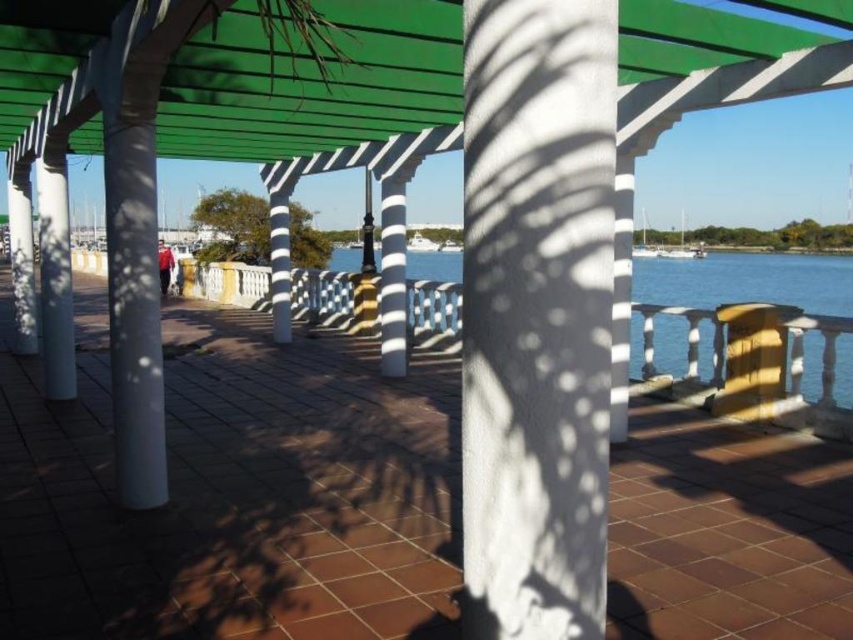
Question: Which of the following is the closest to the observer?

Choices:
 (A) green plastic canopy at upper center
 (B) white textured pillar at center

Answer: (B)

Question: Which of the following is the closest to the observer?

Choices:
 (A) white textured pillar at center
 (B) green plastic canopy at upper center

Answer: (A)

Question: Does white textured pillar at center lie behind green plastic canopy at upper center?

Choices:
 (A) yes
 (B) no

Answer: (B)

Question: Among these points, which one is farthest from the camera?

Choices:
 (A) (548, 348)
 (B) (340, 128)

Answer: (B)

Question: Is white textured pillar at center further to camera compared to green plastic canopy at upper center?

Choices:
 (A) no
 (B) yes

Answer: (A)

Question: Does white textured pillar at center have a smaller size compared to green plastic canopy at upper center?

Choices:
 (A) no
 (B) yes

Answer: (B)